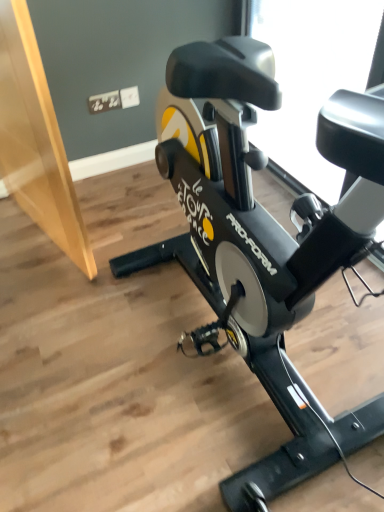
You are a GUI agent. You are given a task and a screenshot of the screen. Output one action in this format:
    pyautogui.click(x=<x>, y=<y>)
    Task: Click on the vacant location below black matte stationary bicycle at center (from a real-world perspective)
    
    Given the screenshot: What is the action you would take?
    [231, 358]